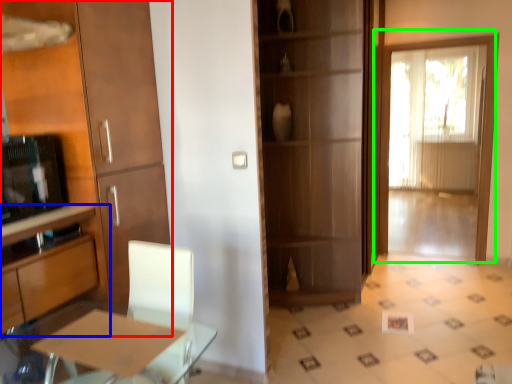
Question: Which is nearer to the cabinetry (highlighted by a red box)? cabinetry (highlighted by a blue box) or door (highlighted by a green box).

Choices:
 (A) cabinetry
 (B) door

Answer: (A)